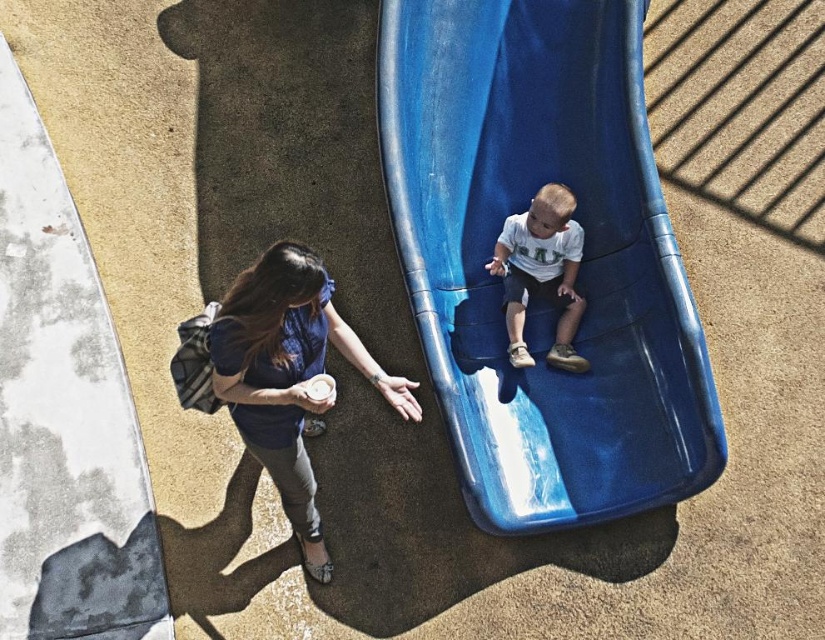
Question: Observing the image, what is the correct spatial positioning of blue plastic slide at center in reference to white matte shirt at center?

Choices:
 (A) left
 (B) right

Answer: (A)

Question: Is blue plastic slide at center to the right of white matte shirt at center from the viewer's perspective?

Choices:
 (A) yes
 (B) no

Answer: (B)

Question: Does blue fabric shirt at lower left come behind white matte shirt at center?

Choices:
 (A) yes
 (B) no

Answer: (B)

Question: Which point is closer to the camera taking this photo?

Choices:
 (A) (383, 1)
 (B) (563, 358)
 (C) (378, 371)

Answer: (C)

Question: Which object is closer to the camera taking this photo?

Choices:
 (A) white matte shirt at center
 (B) blue plastic slide at center

Answer: (B)

Question: Which of the following is the farthest from the observer?

Choices:
 (A) (519, 344)
 (B) (253, 378)

Answer: (A)